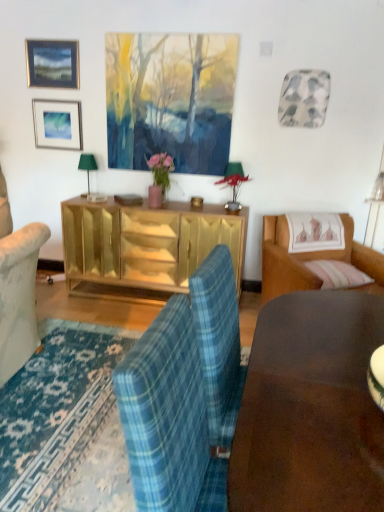
Question: In terms of width, does matte black picture frame at upper left, the 2th picture frame from the bottom, look wider or thinner when compared to matte silver picture frame at upper left, placed as the 2th picture frame when sorted from top to bottom?

Choices:
 (A) wide
 (B) thin

Answer: (B)

Question: From the image's perspective, is matte black picture frame at upper left, placed as the first picture frame when sorted from top to bottom, positioned above or below matte silver picture frame at upper left, placed as the 2th picture frame when sorted from top to bottom?

Choices:
 (A) below
 (B) above

Answer: (B)

Question: Estimate the real-world distances between objects in this image. Which object is closer to the green fabric lampshade at left?

Choices:
 (A) gold mirrored cabinet at center
 (B) brown leather couch at right
 (C) matte black picture frame at upper left, placed as the first picture frame when sorted from top to bottom
 (D) brown wood desk at lower right
 (E) matte silver picture frame at upper left, marked as the 1th picture frame in a bottom-to-top arrangement

Answer: (E)

Question: Which object is positioned closest to the matte silver picture frame at upper left, placed as the 2th picture frame when sorted from top to bottom?

Choices:
 (A) brown leather couch at right
 (B) gold mirrored cabinet at center
 (C) brown wood desk at lower right
 (D) green fabric lampshade at left
 (E) matte black picture frame at upper left, the 2th picture frame from the bottom

Answer: (E)